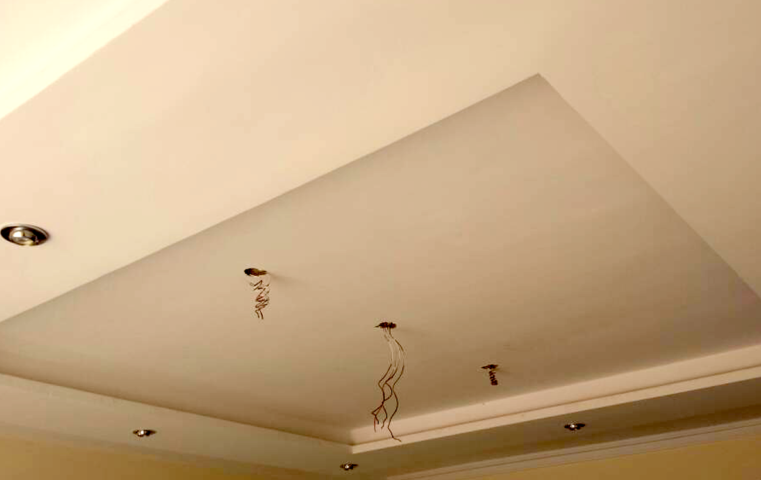
The image size is (761, 480). Find the location of `yellow lighting on wall`. yellow lighting on wall is located at coordinates (40, 57).